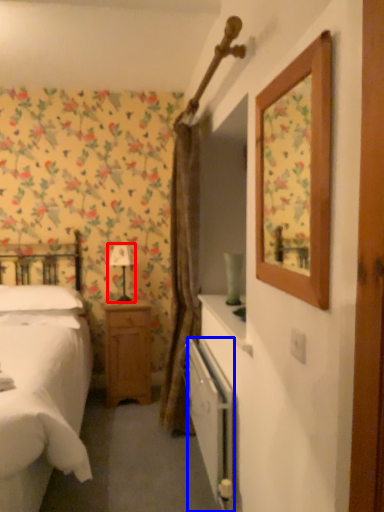
Question: Which object appears farthest to the camera in this image, table lamp (highlighted by a red box) or radiator (highlighted by a blue box)?

Choices:
 (A) table lamp
 (B) radiator

Answer: (A)